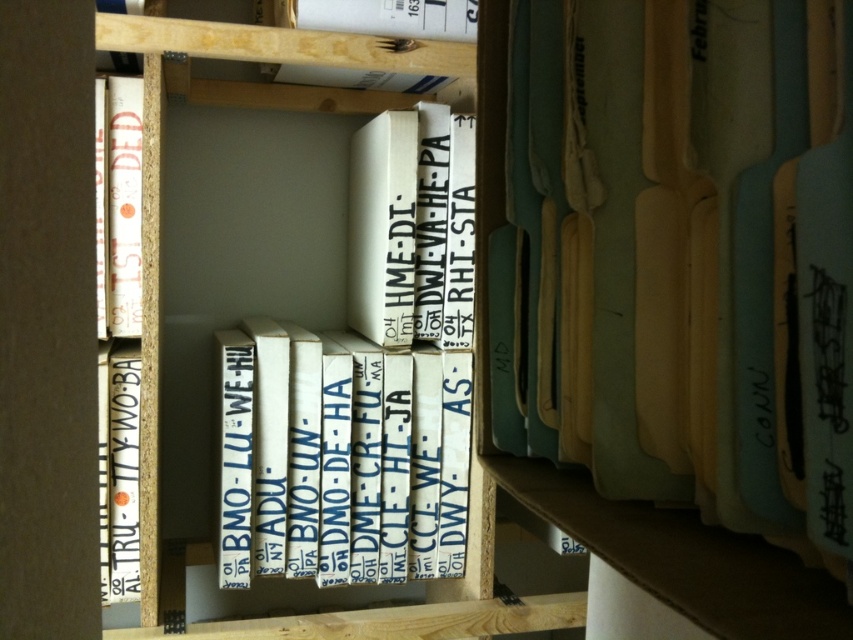
You are organizing items on a shelf and need to place a new item between the white cardboard box at center and the white cardboard book at center. The new item requires at least 40 centimeters of space. Is there enough space between them?

The distance between the white cardboard box at center and the white cardboard book at center is 37.59 centimeters, which is less than the required 40 centimeters. Therefore, there is not enough space to place the new item between them.

You are a warehouse worker who needs to place a new item on the shelf. The new item requires a space that is at least 14 inches wide. Can the space between the light blue cardboard box at center and the nearest box on its left accommodate this new item?

The space between the light blue cardboard box at center and the nearest box on its left is 14.15 inches, which is just enough to fit the new item requiring at least 14 inches of space.

From the picture: You are organizing items on a wooden shelving unit. You have a light blue cardboard box at center and white cardboard boxes at center. Which item is closer to you?

The light blue cardboard box at center is closer to you because it is in front of the white cardboard boxes at center.